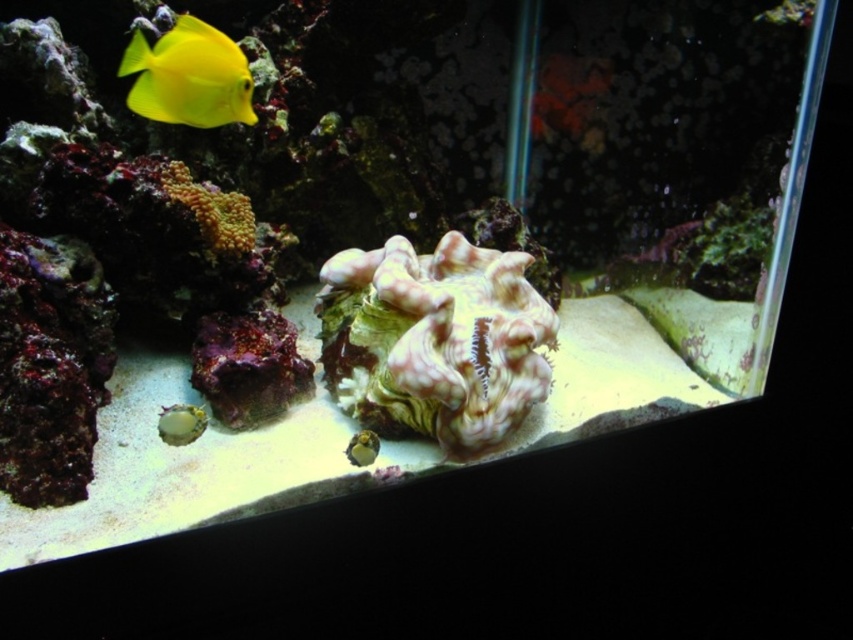
Does yellow matte fish at upper left appear over translucent yellowish-green shell at lower left?

Correct, yellow matte fish at upper left is located above translucent yellowish-green shell at lower left.

Which of these two, yellow matte fish at upper left or translucent yellowish-green shell at lower left, stands shorter?

With less height is translucent yellowish-green shell at lower left.

Between point (125, 54) and point (177, 428), which one is positioned behind?

Point (125, 54)

In order to click on yellow matte fish at upper left in this screenshot , I will do (x=189, y=76).

Does translucent yellowish-green shell at lower left have a greater width compared to shiny yellow fish at lower center?

Yes.

Is translucent yellowish-green shell at lower left shorter than shiny yellow fish at lower center?

No, translucent yellowish-green shell at lower left is not shorter than shiny yellow fish at lower center.

Between point (181, 419) and point (358, 461), which one is positioned in front?

Point (181, 419) is more forward.

At what (x,y) coordinates should I click in order to perform the action: click on translucent yellowish-green shell at lower left. Please return your answer as a coordinate pair (x, y). The height and width of the screenshot is (640, 853). Looking at the image, I should click on (180, 422).

Between point (138, 54) and point (369, 444), which one is positioned behind?

Positioned behind is point (369, 444).

Between yellow matte fish at upper left and shiny yellow fish at lower center, which one appears on the right side from the viewer's perspective?

Positioned to the right is shiny yellow fish at lower center.

Is point (163, 51) farther from camera compared to point (352, 442)?

No.

Where is `yellow matte fish at upper left`? The height and width of the screenshot is (640, 853). yellow matte fish at upper left is located at coordinates (189, 76).